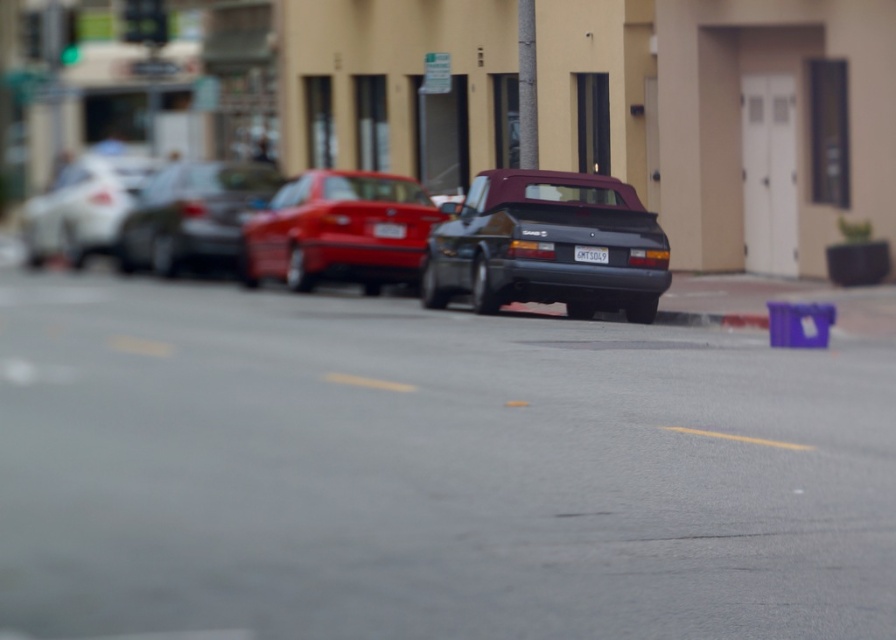
Question: Which point is farther to the camera?

Choices:
 (A) (369, 259)
 (B) (576, 250)
 (C) (202, 225)

Answer: (C)

Question: From the image, what is the correct spatial relationship of shiny silver sedan at center in relation to white plastic license plate at center?

Choices:
 (A) above
 (B) below

Answer: (A)

Question: Is glossy red car at center smaller than white plastic license plate at center?

Choices:
 (A) yes
 (B) no

Answer: (B)

Question: Which point appears closest to the camera in this image?

Choices:
 (A) (63, 204)
 (B) (464, 257)
 (C) (606, 259)
 (D) (217, 176)

Answer: (C)

Question: Which point is closer to the camera?

Choices:
 (A) glossy red car at center
 (B) white plastic license plate at center

Answer: (B)

Question: Is satin black convertible at center above glossy red car at center?

Choices:
 (A) no
 (B) yes

Answer: (A)